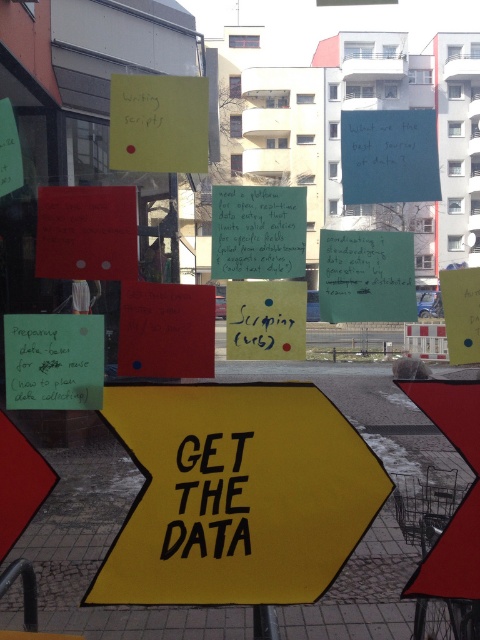
Is yellow matte arrow at center above green matte paper at center?

No.

Between yellow matte arrow at center and green matte paper at center, which one is positioned higher?

green matte paper at center is higher up.

Is point (157, 566) closer to camera compared to point (268, 188)?

Yes, it is in front of point (268, 188).

The height and width of the screenshot is (640, 480). Find the location of `yellow matte arrow at center`. yellow matte arrow at center is located at coordinates (236, 493).

Who is more forward, [108,577] or [275,621]?

Positioned in front is point [108,577].

The width and height of the screenshot is (480, 640). In order to click on yellow matte arrow at center in this screenshot , I will do `click(236, 493)`.

You are a GUI agent. You are given a task and a screenshot of the screen. Output one action in this format:
    pyautogui.click(x=<x>, y=<y>)
    Task: Click on the yellow matte arrow at center
    The image size is (480, 640).
    Given the screenshot: What is the action you would take?
    pyautogui.click(x=236, y=493)

Does yellow matte arrow at center appear under black paper at center?

Correct, yellow matte arrow at center is located below black paper at center.

Can you confirm if yellow matte arrow at center is thinner than black paper at center?

No, yellow matte arrow at center is not thinner than black paper at center.

The image size is (480, 640). Describe the element at coordinates (236, 493) in the screenshot. I see `yellow matte arrow at center` at that location.

Where is `yellow matte arrow at center`? This screenshot has height=640, width=480. yellow matte arrow at center is located at coordinates (236, 493).